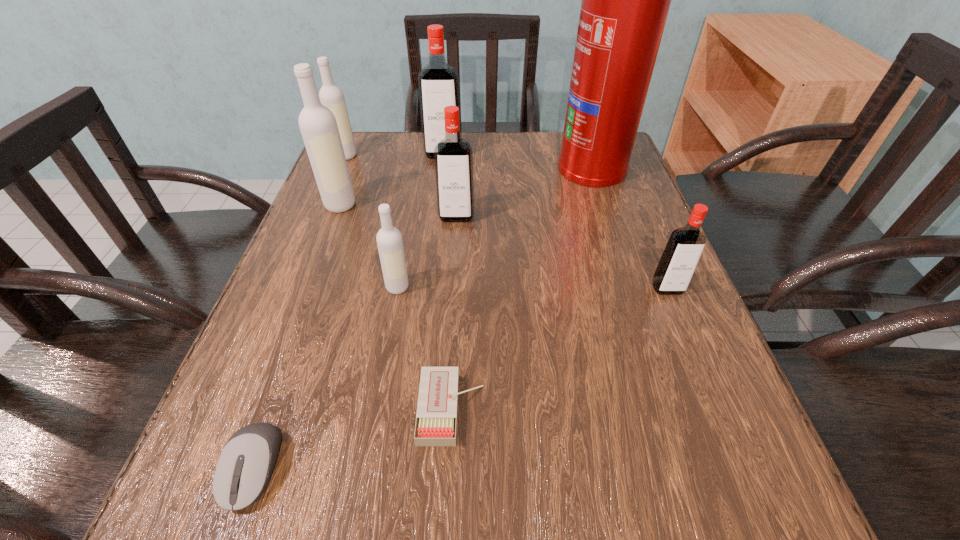
Find the location of a particular element. free point between the second smallest white vodka and the second smallest red vodka is located at coordinates (401, 186).

Locate an element on the screen. This screenshot has width=960, height=540. free space between the second nearest red vodka and the eighth tallest object is located at coordinates (355, 342).

Locate an element on the screen. Image resolution: width=960 pixels, height=540 pixels. vacant region between the smallest white vodka and the biggest red vodka is located at coordinates (420, 220).

Where is `vacant area between the smallest white vodka and the farthest red vodka`? This screenshot has width=960, height=540. vacant area between the smallest white vodka and the farthest red vodka is located at coordinates (420, 220).

The width and height of the screenshot is (960, 540). I want to click on vacant space that is in between the farthest red vodka and the shortest object, so click(447, 281).

The width and height of the screenshot is (960, 540). What are the coordinates of `free area in between the computer equipment and the fire extinguisher` in the screenshot? It's located at (422, 317).

Point out which object is positioned as the second nearest to the white matchbox. Please provide its 2D coordinates. Your answer should be formatted as a tuple, i.e. [(x, y)], where the tuple contains the x and y coordinates of a point satisfying the conditions above.

[(244, 468)]

Identify which object is located as the second nearest to the biggest red vodka. Please provide its 2D coordinates. Your answer should be formatted as a tuple, i.e. [(x, y)], where the tuple contains the x and y coordinates of a point satisfying the conditions above.

[(318, 126)]

Find the location of `vodka object that ranks as the closest to the smallest white vodka`. vodka object that ranks as the closest to the smallest white vodka is located at coordinates (453, 156).

At what (x,y) coordinates should I click in order to perform the action: click on vodka that can be found as the fifth closest to the second smallest white vodka. Please return your answer as a coordinate pair (x, y). Image resolution: width=960 pixels, height=540 pixels. Looking at the image, I should click on (683, 250).